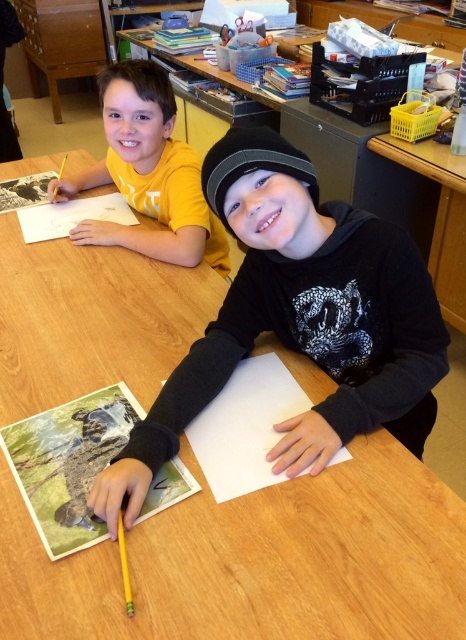
Can you confirm if wooden table at center is positioned below matte yellow shirt at upper left?

Actually, wooden table at center is above matte yellow shirt at upper left.

Which is in front, point (356, 172) or point (205, 220)?

Point (205, 220) is in front.

Locate an element on the screen. This screenshot has width=466, height=640. wooden table at center is located at coordinates (382, 180).

Does wooden table at center appear over white paper at upper left?

Yes.

What do you see at coordinates (382, 180) in the screenshot? This screenshot has width=466, height=640. I see `wooden table at center` at bounding box center [382, 180].

What do you see at coordinates (382, 180) in the screenshot?
I see `wooden table at center` at bounding box center [382, 180].

Locate an element on the screen. wooden table at center is located at coordinates (382, 180).

Can you confirm if matte yellow shirt at upper left is positioned above white paper at center?

Indeed, matte yellow shirt at upper left is positioned over white paper at center.

Can you confirm if matte yellow shirt at upper left is positioned to the right of white paper at center?

No, matte yellow shirt at upper left is not to the right of white paper at center.

Is point (143, 234) farther from viewer compared to point (230, 467)?

Yes.

Find the location of a particular element. matte yellow shirt at upper left is located at coordinates 148,173.